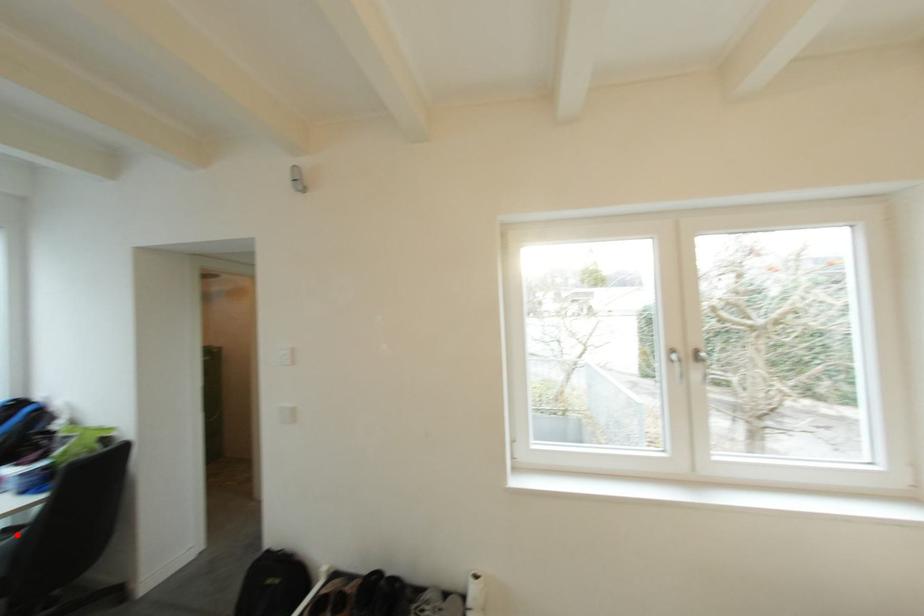
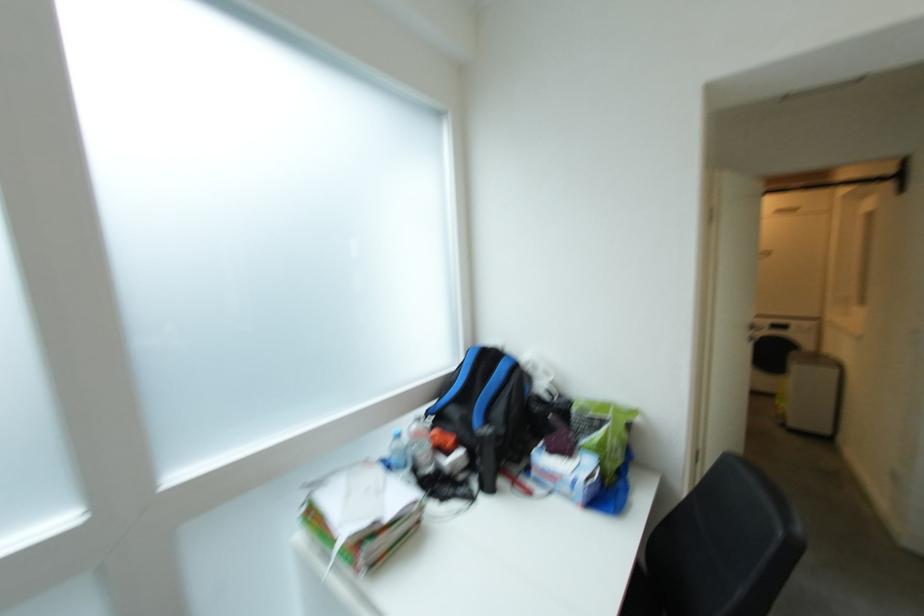
Question: I am providing you with two images of the same scene from different viewpoints. A red point is marked on the first image. At the location where the point appears in image 1, is it still visible in image 2?

Choices:
 (A) Yes
 (B) No

Answer: (B)